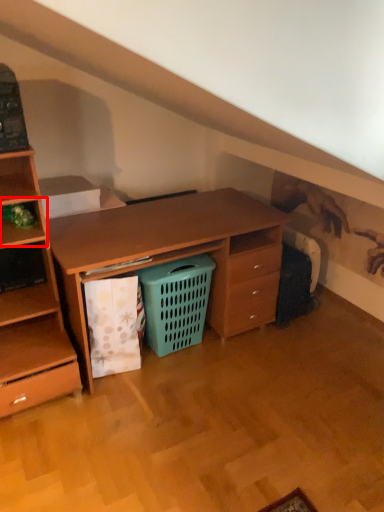
Question: From the image's perspective, considering the relative positions of shelf (annotated by the red box) and shopping basket in the image provided, where is shelf (annotated by the red box) located with respect to the staircase?

Choices:
 (A) below
 (B) above

Answer: (B)